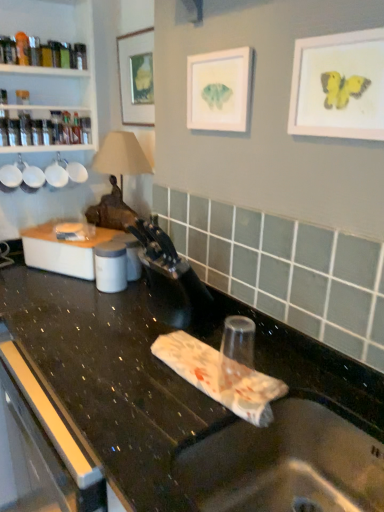
The height and width of the screenshot is (512, 384). Find the location of `free space above black granite countertop at center (from a real-world perspective)`. free space above black granite countertop at center (from a real-world perspective) is located at coordinates (116, 342).